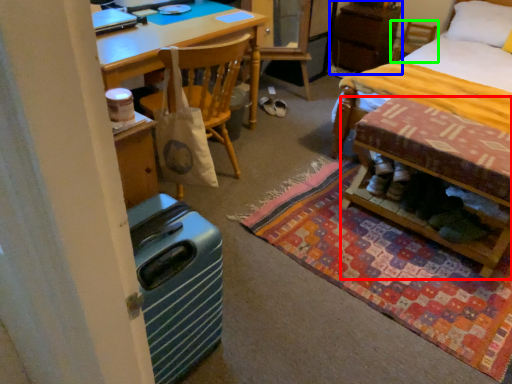
Question: Which object is positioned farthest from table (highlighted by a red box)? Select from cabinetry (highlighted by a blue box) and chair (highlighted by a green box).

Choices:
 (A) cabinetry
 (B) chair

Answer: (B)